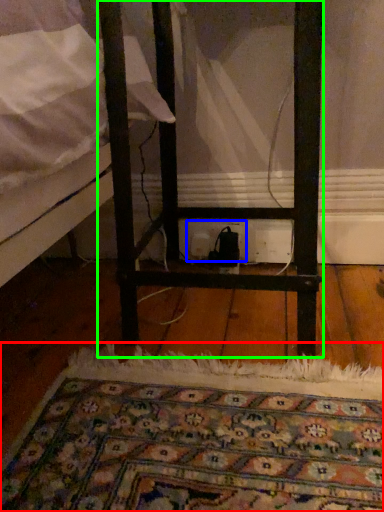
Question: Considering the real-world distances, which object is closest to mat (highlighted by a red box)? electric outlet (highlighted by a blue box) or furniture (highlighted by a green box).

Choices:
 (A) electric outlet
 (B) furniture

Answer: (B)